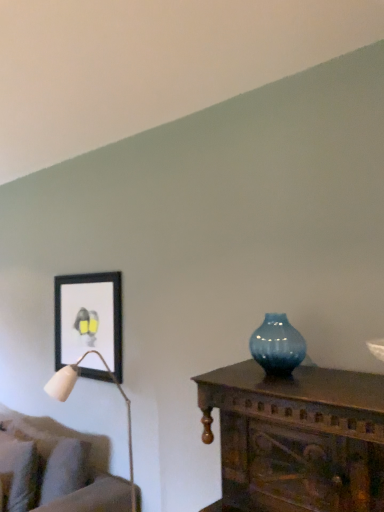
Question: From a real-world perspective, is velvet beige couch at lower left on top of black matte picture frame at upper left?

Choices:
 (A) no
 (B) yes

Answer: (A)

Question: Can you confirm if velvet beige couch at lower left is bigger than black matte picture frame at upper left?

Choices:
 (A) yes
 (B) no

Answer: (A)

Question: From the image's perspective, is velvet beige couch at lower left on black matte picture frame at upper left?

Choices:
 (A) no
 (B) yes

Answer: (A)

Question: Can you confirm if velvet beige couch at lower left is wider than black matte picture frame at upper left?

Choices:
 (A) no
 (B) yes

Answer: (B)

Question: Does velvet beige couch at lower left have a greater height compared to black matte picture frame at upper left?

Choices:
 (A) no
 (B) yes

Answer: (B)

Question: From the image's perspective, is velvet beige couch at lower left under black matte picture frame at upper left?

Choices:
 (A) no
 (B) yes

Answer: (B)

Question: Can you confirm if velvet beige couch at lower left is bigger than blue glass vase at center?

Choices:
 (A) no
 (B) yes

Answer: (B)

Question: Is velvet beige couch at lower left positioned beyond the bounds of blue glass vase at center?

Choices:
 (A) yes
 (B) no

Answer: (A)

Question: Can you confirm if velvet beige couch at lower left is smaller than blue glass vase at center?

Choices:
 (A) no
 (B) yes

Answer: (A)

Question: Is velvet beige couch at lower left wider than blue glass vase at center?

Choices:
 (A) yes
 (B) no

Answer: (A)

Question: Is blue glass vase at center located within velvet beige couch at lower left?

Choices:
 (A) no
 (B) yes

Answer: (A)

Question: From a real-world perspective, is velvet beige couch at lower left on top of blue glass vase at center?

Choices:
 (A) no
 (B) yes

Answer: (A)

Question: Are black matte picture frame at upper left and velvet beige couch at lower left making contact?

Choices:
 (A) no
 (B) yes

Answer: (A)